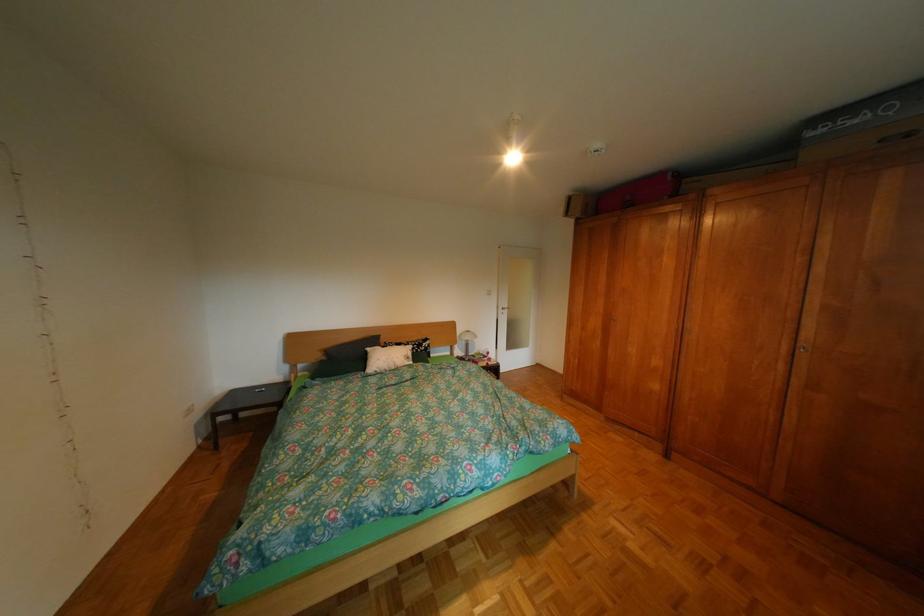
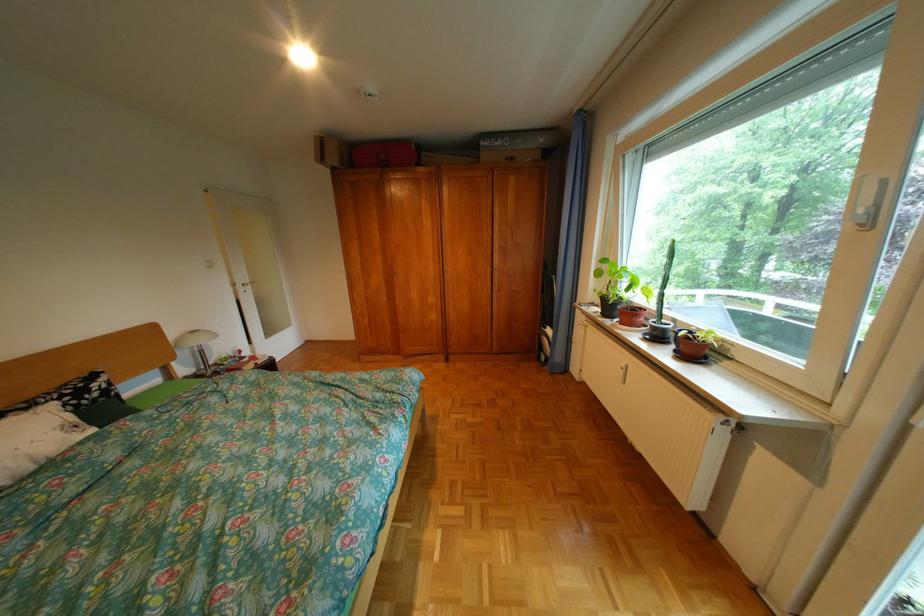
The point at (592, 216) is marked in the first image. Where is the corresponding point in the second image?

(350, 164)